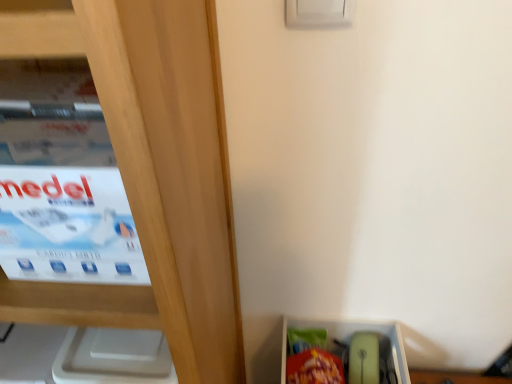
The width and height of the screenshot is (512, 384). What do you see at coordinates (61, 184) in the screenshot?
I see `white cardboard box at left` at bounding box center [61, 184].

Locate an element on the screen. This screenshot has height=384, width=512. white cardboard box at left is located at coordinates (61, 184).

Find the location of `matte plastic storage box at lower right`. matte plastic storage box at lower right is located at coordinates (347, 354).

This screenshot has width=512, height=384. What do you see at coordinates (347, 354) in the screenshot?
I see `matte plastic storage box at lower right` at bounding box center [347, 354].

Based on the photo, in order to face matte plastic storage box at lower right, should I rotate leftwards or rightwards?

Rotate your view right by about 10.978°.

Where is `white cardboard box at left`? The width and height of the screenshot is (512, 384). white cardboard box at left is located at coordinates (61, 184).

Considering the relative positions of white cardboard box at left and matte plastic storage box at lower right in the image provided, is white cardboard box at left to the right of matte plastic storage box at lower right from the viewer's perspective?

No, white cardboard box at left is not to the right of matte plastic storage box at lower right.

Which object is further away from the camera, white cardboard box at left or matte plastic storage box at lower right?

matte plastic storage box at lower right is further from the camera.

Considering the positions of point (79, 147) and point (396, 373), is point (79, 147) closer or farther from the camera than point (396, 373)?

Point (79, 147) appears to be closer to the viewer than point (396, 373).

From the image's perspective, which is above, white cardboard box at left or matte plastic storage box at lower right?

white cardboard box at left, from the image's perspective.

From a real-world perspective, who is located lower, white cardboard box at left or matte plastic storage box at lower right?

From a 3D spatial view, matte plastic storage box at lower right is below.

In terms of width, does white cardboard box at left look wider or thinner when compared to matte plastic storage box at lower right?

Considering their sizes, white cardboard box at left looks slimmer than matte plastic storage box at lower right.

Can you confirm if white cardboard box at left is taller than matte plastic storage box at lower right?

Correct, white cardboard box at left is much taller as matte plastic storage box at lower right.

Considering the sizes of objects white cardboard box at left and matte plastic storage box at lower right in the image provided, who is smaller, white cardboard box at left or matte plastic storage box at lower right?

Smaller between the two is white cardboard box at left.

Is white cardboard box at left located outside matte plastic storage box at lower right?

Yes, white cardboard box at left is outside of matte plastic storage box at lower right.

Is white cardboard box at left far from matte plastic storage box at lower right?

No, there isn't a large distance between white cardboard box at left and matte plastic storage box at lower right.

Is white cardboard box at left facing away from matte plastic storage box at lower right?

white cardboard box at left does not have its back to matte plastic storage box at lower right.

Measure the distance from white cardboard box at left to matte plastic storage box at lower right.

The distance of white cardboard box at left from matte plastic storage box at lower right is 24.95 inches.

The image size is (512, 384). Identify the location of storage box that is below the white cardboard box at left (from the image's perspective). (347, 354).

Based on their positions, is matte plastic storage box at lower right located to the left or right of white cardboard box at left?

matte plastic storage box at lower right is positioned on white cardboard box at left's right side.

Looking at this image, considering their positions, is matte plastic storage box at lower right located in front of or behind white cardboard box at left?

In the image, matte plastic storage box at lower right appears behind white cardboard box at left.

Is point (390, 337) less distant than point (78, 135)?

That is False.

From the image's perspective, who appears lower, matte plastic storage box at lower right or white cardboard box at left?

matte plastic storage box at lower right appears lower in the image.

From a real-world perspective, does matte plastic storage box at lower right stand above white cardboard box at left?

Incorrect, from a real-world perspective, matte plastic storage box at lower right is lower than white cardboard box at left.

Considering the relative sizes of matte plastic storage box at lower right and white cardboard box at left in the image provided, is matte plastic storage box at lower right wider than white cardboard box at left?

Correct, the width of matte plastic storage box at lower right exceeds that of white cardboard box at left.

In terms of height, does matte plastic storage box at lower right look taller or shorter compared to white cardboard box at left?

Clearly, matte plastic storage box at lower right is shorter compared to white cardboard box at left.

Between matte plastic storage box at lower right and white cardboard box at left, which one has larger size?

With larger size is matte plastic storage box at lower right.

Is matte plastic storage box at lower right situated inside white cardboard box at left or outside?

matte plastic storage box at lower right is located beyond the bounds of white cardboard box at left.

Would you say matte plastic storage box at lower right is a long distance from white cardboard box at left?

No.

Is matte plastic storage box at lower right turned away from white cardboard box at left?

No, matte plastic storage box at lower right is not facing the opposite direction of white cardboard box at left.

How many degrees apart are the facing directions of matte plastic storage box at lower right and white cardboard box at left?

0.736 degrees.

At what (x,y) coordinates should I click in order to perform the action: click on storage box located on the right of white cardboard box at left. Please return your answer as a coordinate pair (x, y). This screenshot has width=512, height=384. Looking at the image, I should click on (347, 354).

The height and width of the screenshot is (384, 512). I want to click on storage box that appears below the white cardboard box at left (from a real-world perspective), so coord(347,354).

Locate an element on the screen. This screenshot has height=384, width=512. storage box located below the white cardboard box at left (from the image's perspective) is located at coordinates (347, 354).